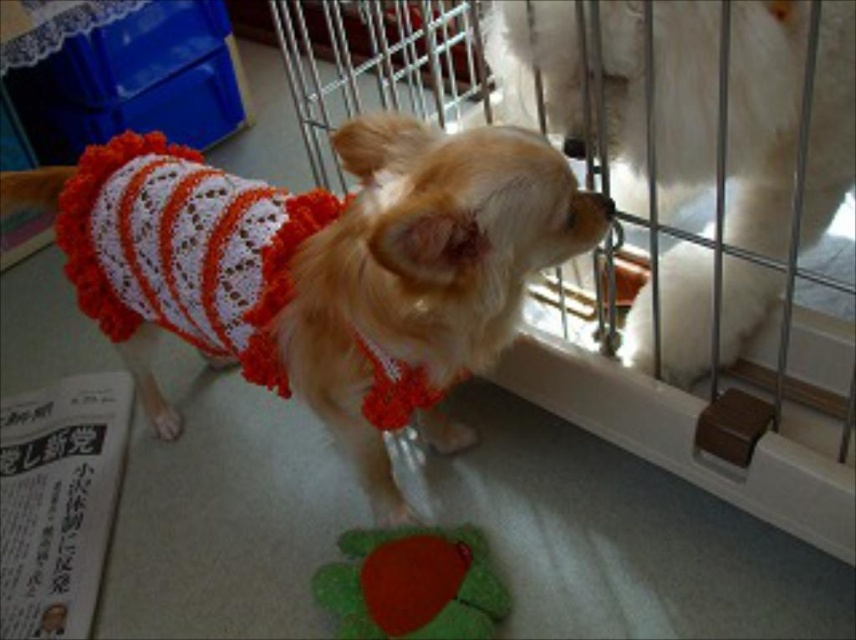
You are a small dog wearing a crocheted garment with white and orange stripes and frills. You want to reach the velvety green plush toy at center. Can you easily step over the metal wire cage at center to get to it?

The metal wire cage at center is much taller than the velvety green plush toy at center, so it might be difficult for the small dog to step over the metal wire cage at center to reach the toy.

You are a dog trainer trying to determine if the white fluffy dog at center can comfortably turn around inside the metal wire cage at center. Based on the scene, can it?

The metal wire cage at center is wider than the white fluffy dog at center, so the dog should have enough space to turn around comfortably inside the metal wire cage at center.